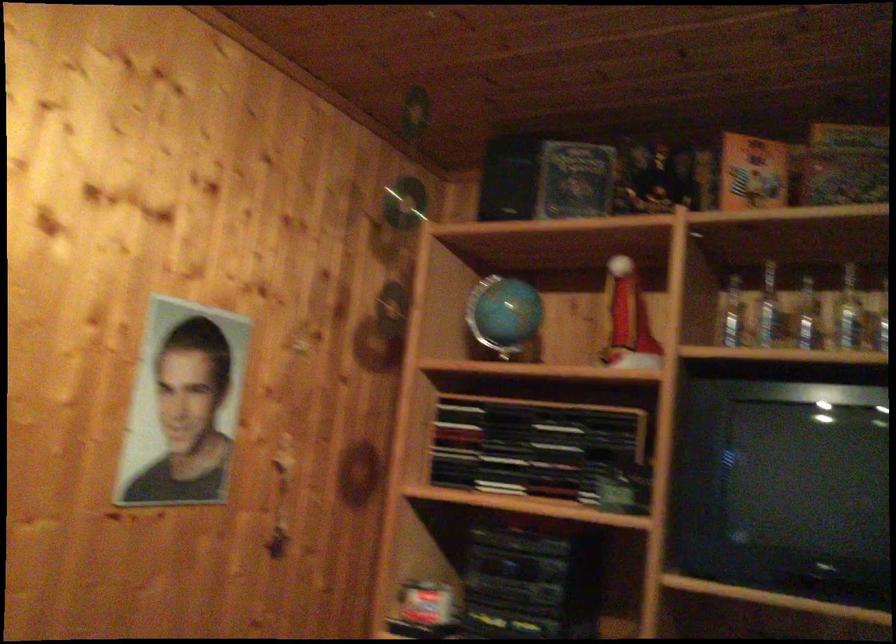
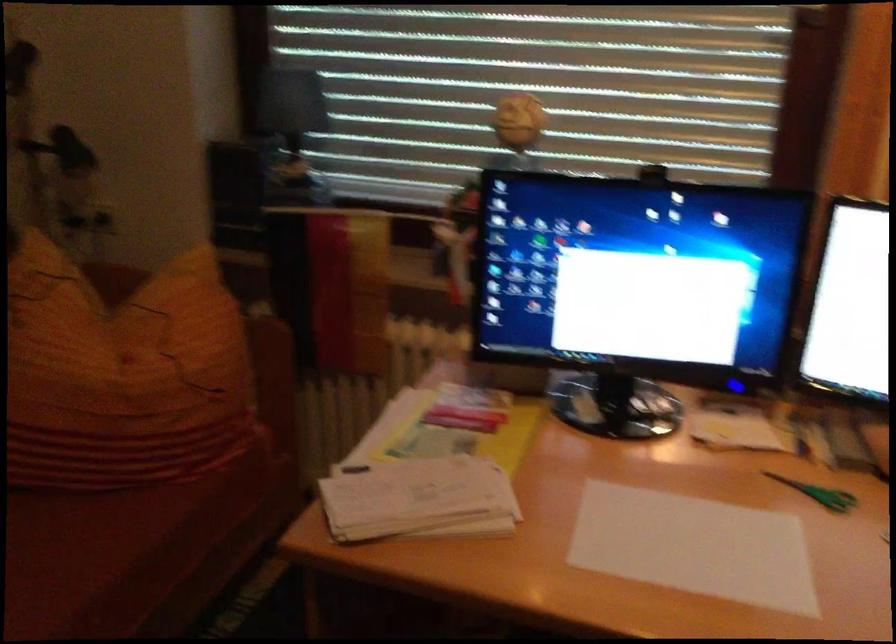
The first image is from the beginning of the video and the second image is from the end. How did the camera likely rotate when shooting the video?

The rotation direction of the camera is left-down.